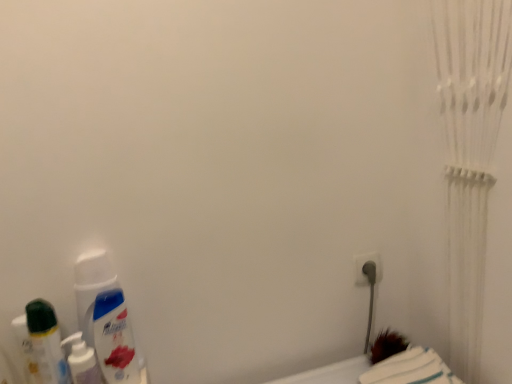
Question: Does white plastic plug at lower right come behind white soft towel at lower right?

Choices:
 (A) yes
 (B) no

Answer: (A)

Question: From the image's perspective, does white plastic plug at lower right appear lower than white soft towel at lower right?

Choices:
 (A) no
 (B) yes

Answer: (A)

Question: From a real-world perspective, does white plastic plug at lower right stand above white soft towel at lower right?

Choices:
 (A) yes
 (B) no

Answer: (A)

Question: From a real-world perspective, is white plastic plug at lower right positioned under white soft towel at lower right based on gravity?

Choices:
 (A) no
 (B) yes

Answer: (A)

Question: Does white plastic plug at lower right lie in front of white soft towel at lower right?

Choices:
 (A) no
 (B) yes

Answer: (A)

Question: In terms of width, does white glossy mouthwash at lower left, which is the 2th mouthwash in right-to-left order, look wider or thinner when compared to white plastic plug at lower right?

Choices:
 (A) thin
 (B) wide

Answer: (B)

Question: In terms of height, does white glossy mouthwash at lower left, which is the second mouthwash from left to right, look taller or shorter compared to white plastic plug at lower right?

Choices:
 (A) short
 (B) tall

Answer: (B)

Question: From a real-world perspective, is white glossy mouthwash at lower left, which is the 2th mouthwash in right-to-left order, physically located above or below white plastic plug at lower right?

Choices:
 (A) below
 (B) above

Answer: (A)

Question: Do you think white glossy mouthwash at lower left, which is the second mouthwash from left to right, is within white plastic plug at lower right, or outside of it?

Choices:
 (A) outside
 (B) inside

Answer: (A)

Question: Is point (92, 350) positioned closer to the camera than point (409, 362)?

Choices:
 (A) farther
 (B) closer

Answer: (B)

Question: In the image, is white glossy mouthwash at lower left, which is the 2th mouthwash in right-to-left order, positioned in front of or behind white soft towel at lower right?

Choices:
 (A) front
 (B) behind

Answer: (B)

Question: Looking at their shapes, would you say white glossy mouthwash at lower left, which is the second mouthwash from left to right, is wider or thinner than white soft towel at lower right?

Choices:
 (A) thin
 (B) wide

Answer: (A)

Question: Is white glossy mouthwash at lower left, which is the 2th mouthwash in right-to-left order, bigger or smaller than white soft towel at lower right?

Choices:
 (A) big
 (B) small

Answer: (B)

Question: Is white plastic plug at lower right taller or shorter than white soft towel at lower right?

Choices:
 (A) tall
 (B) short

Answer: (A)

Question: Is white plastic plug at lower right inside or outside of white soft towel at lower right?

Choices:
 (A) outside
 (B) inside

Answer: (A)